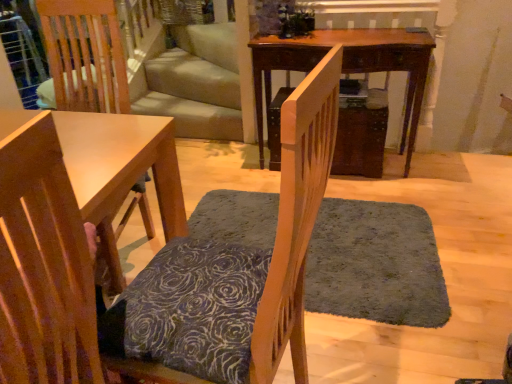
Question: From a real-world perspective, is dark gray shaggy rug at center under wooden chair with patterned cushion at center, which appears as the 1th chair when viewed from the right?

Choices:
 (A) yes
 (B) no

Answer: (A)

Question: Is dark gray shaggy rug at center located outside wooden chair with patterned cushion at center, acting as the second chair starting from the left?

Choices:
 (A) yes
 (B) no

Answer: (A)

Question: Is dark gray shaggy rug at center in front of wooden chair with patterned cushion at center, acting as the second chair starting from the left?

Choices:
 (A) no
 (B) yes

Answer: (A)

Question: From the image's perspective, is dark gray shaggy rug at center on top of wooden chair with patterned cushion at center, acting as the second chair starting from the left?

Choices:
 (A) yes
 (B) no

Answer: (B)

Question: Can you confirm if dark gray shaggy rug at center is shorter than wooden chair with patterned cushion at center, which appears as the 1th chair when viewed from the right?

Choices:
 (A) no
 (B) yes

Answer: (B)

Question: Is wooden chair with patterned cushion at center, acting as the second chair starting from the left, inside dark gray shaggy rug at center?

Choices:
 (A) yes
 (B) no

Answer: (B)

Question: From the image's perspective, is wooden chair with patterned cushion at center, which appears as the 1th chair when viewed from the right, beneath wooden chair at lower left, arranged as the second chair when viewed from the right?

Choices:
 (A) no
 (B) yes

Answer: (A)

Question: From a real-world perspective, does wooden chair with patterned cushion at center, acting as the second chair starting from the left, stand above wooden chair at lower left, which ranks as the first chair in left-to-right order?

Choices:
 (A) yes
 (B) no

Answer: (B)

Question: Does wooden chair with patterned cushion at center, which appears as the 1th chair when viewed from the right, appear on the left side of wooden chair at lower left, which ranks as the first chair in left-to-right order?

Choices:
 (A) no
 (B) yes

Answer: (A)

Question: Considering the relative sizes of wooden chair with patterned cushion at center, acting as the second chair starting from the left, and wooden chair at lower left, which ranks as the first chair in left-to-right order, in the image provided, is wooden chair with patterned cushion at center, acting as the second chair starting from the left, bigger than wooden chair at lower left, which ranks as the first chair in left-to-right order,?

Choices:
 (A) no
 (B) yes

Answer: (B)

Question: Are wooden chair with patterned cushion at center, acting as the second chair starting from the left, and wooden chair at lower left, arranged as the second chair when viewed from the right, located far from each other?

Choices:
 (A) no
 (B) yes

Answer: (A)

Question: From the image's perspective, would you say wooden chair with patterned cushion at center, acting as the second chair starting from the left, is positioned over wooden chair at lower left, which ranks as the first chair in left-to-right order?

Choices:
 (A) yes
 (B) no

Answer: (A)

Question: Is wooden chair with patterned cushion at center, which appears as the 1th chair when viewed from the right, to the right of mahogany wood table at center from the viewer's perspective?

Choices:
 (A) no
 (B) yes

Answer: (A)